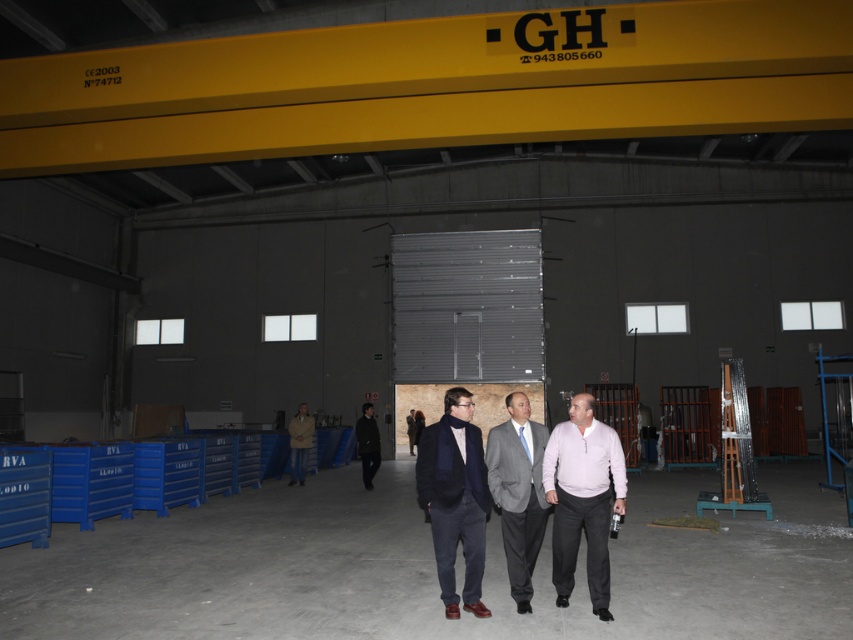
Which of these two, pink matte sweater at center or blue silk tie at center, stands shorter?

Standing shorter between the two is blue silk tie at center.

Which is in front, point (595, 518) or point (526, 442)?

Point (595, 518) is more forward.

Who is more distant from viewer, [544,477] or [526,451]?

The point [526,451] is more distant.

In order to click on pink matte sweater at center in this screenshot , I will do `click(582, 499)`.

Is point (457, 508) positioned after point (361, 413)?

No, it is in front of (361, 413).

Does point (473, 563) come closer to viewer compared to point (373, 436)?

Yes, point (473, 563) is in front of point (373, 436).

Locate an element on the screen. dark blue wool coat at center is located at coordinates (456, 499).

Based on the photo, which is more to the right, dark blue wool coat at center or gray suit at center?

gray suit at center

Looking at this image, can you confirm if dark blue wool coat at center is shorter than gray suit at center?

In fact, dark blue wool coat at center may be taller than gray suit at center.

Between point (422, 452) and point (527, 609), which one is positioned behind?

Point (527, 609)

Locate an element on the screen. This screenshot has width=853, height=640. dark blue wool coat at center is located at coordinates (456, 499).